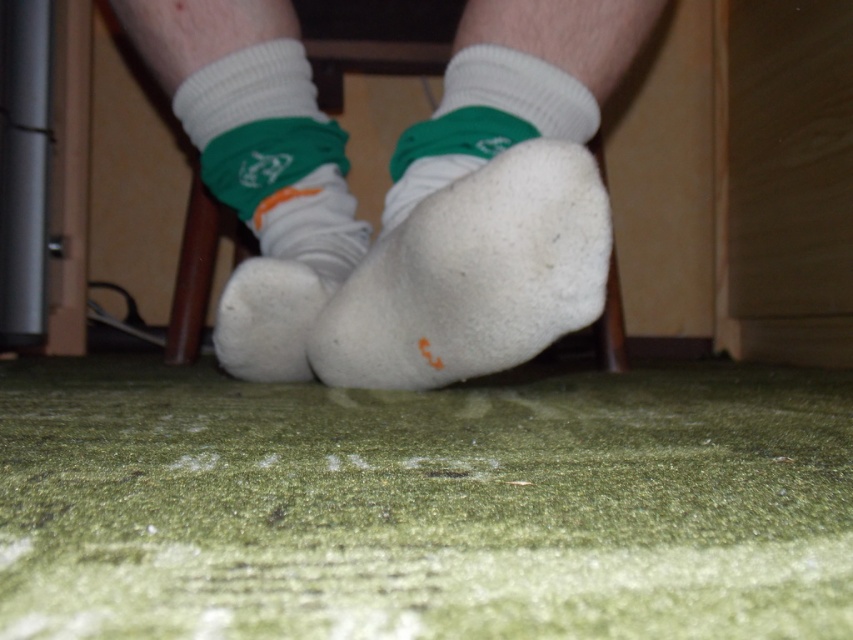
Is point (579, 273) closer to camera compared to point (293, 304)?

Yes, it is in front of point (293, 304).

Between white fuzzy sock at center and white fuzzy sock at lower center, which one appears on the left side from the viewer's perspective?

white fuzzy sock at lower center

What do you see at coordinates (473, 275) in the screenshot? The width and height of the screenshot is (853, 640). I see `white fuzzy sock at center` at bounding box center [473, 275].

You are a GUI agent. You are given a task and a screenshot of the screen. Output one action in this format:
    pyautogui.click(x=<x>, y=<y>)
    Task: Click on the white fuzzy sock at center
    The image size is (853, 640).
    Given the screenshot: What is the action you would take?
    pyautogui.click(x=473, y=275)

Does white cotton socks at center appear on the left side of white fuzzy sock at center?

Correct, you'll find white cotton socks at center to the left of white fuzzy sock at center.

Does white cotton socks at center appear over white fuzzy sock at center?

Yes.

Measure the distance between white cotton socks at center and camera.

white cotton socks at center is 31.09 inches from camera.

Locate an element on the screen. Image resolution: width=853 pixels, height=640 pixels. white cotton socks at center is located at coordinates (402, 189).

Which is more to the left, white cotton socks at center or white fuzzy sock at lower center?

white fuzzy sock at lower center

Is point (219, 188) farther from viewer compared to point (323, 289)?

Yes, it is.

Between point (442, 257) and point (286, 352), which one is positioned behind?

Point (286, 352)

Find the location of a particular element. white cotton socks at center is located at coordinates (402, 189).